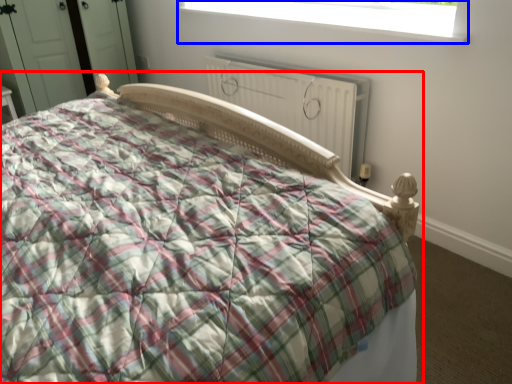
Question: Among these objects, which one is nearest to the camera, bed (highlighted by a red box) or window (highlighted by a blue box)?

Choices:
 (A) bed
 (B) window

Answer: (A)